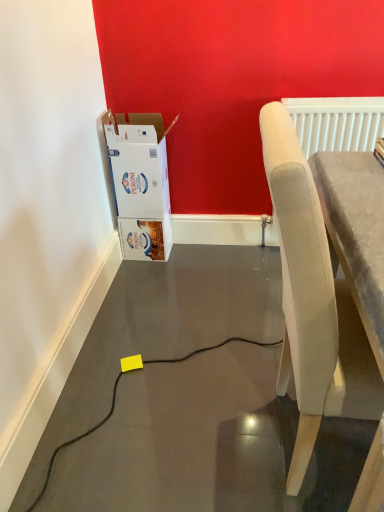
Question: From the image's perspective, would you say light gray fabric chair at right is shown under white cardboard box at left?

Choices:
 (A) no
 (B) yes

Answer: (B)

Question: Considering the relative sizes of light gray fabric chair at right and white cardboard box at left in the image provided, is light gray fabric chair at right taller than white cardboard box at left?

Choices:
 (A) no
 (B) yes

Answer: (B)

Question: Does light gray fabric chair at right have a lesser height compared to white cardboard box at left?

Choices:
 (A) no
 (B) yes

Answer: (A)

Question: From the image's perspective, is light gray fabric chair at right above white cardboard box at left?

Choices:
 (A) yes
 (B) no

Answer: (B)

Question: Would you consider light gray fabric chair at right to be distant from white cardboard box at left?

Choices:
 (A) yes
 (B) no

Answer: (A)

Question: Is white cardboard box at left to the left or to the right of light gray fabric chair at right in the image?

Choices:
 (A) left
 (B) right

Answer: (A)

Question: Considering the positions of white cardboard box at left and light gray fabric chair at right in the image, is white cardboard box at left bigger or smaller than light gray fabric chair at right?

Choices:
 (A) small
 (B) big

Answer: (A)

Question: Looking at their shapes, would you say white cardboard box at left is wider or thinner than light gray fabric chair at right?

Choices:
 (A) thin
 (B) wide

Answer: (A)

Question: From a real-world perspective, is white cardboard box at left positioned above or below light gray fabric chair at right?

Choices:
 (A) above
 (B) below

Answer: (B)

Question: Is light gray fabric chair at right wider or thinner than white cardboard box at left?

Choices:
 (A) wide
 (B) thin

Answer: (A)

Question: In terms of height, does light gray fabric chair at right look taller or shorter compared to white cardboard box at left?

Choices:
 (A) short
 (B) tall

Answer: (B)

Question: From the image's perspective, is light gray fabric chair at right above or below white cardboard box at left?

Choices:
 (A) below
 (B) above

Answer: (A)

Question: Considering the relative positions of light gray fabric chair at right and white cardboard box at left in the image provided, is light gray fabric chair at right to the left or to the right of white cardboard box at left?

Choices:
 (A) right
 (B) left

Answer: (A)

Question: From the image's perspective, relative to light gray fabric chair at right, is white textured radiator at upper right above or below?

Choices:
 (A) above
 (B) below

Answer: (A)

Question: Is white textured radiator at upper right inside or outside of light gray fabric chair at right?

Choices:
 (A) outside
 (B) inside

Answer: (A)